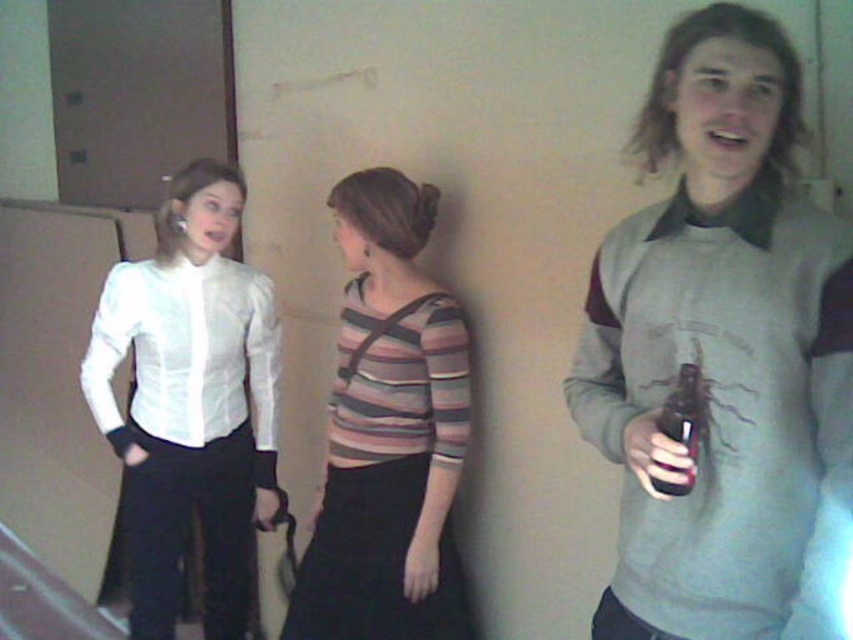
Question: Does gray sweater at center have a lesser width compared to translucent plastic bottle at right?

Choices:
 (A) yes
 (B) no

Answer: (B)

Question: Does gray sweater at center appear under translucent plastic bottle at right?

Choices:
 (A) no
 (B) yes

Answer: (A)

Question: Which point appears closest to the camera in this image?

Choices:
 (A) (700, 433)
 (B) (314, 544)

Answer: (A)

Question: Which object is positioned farthest from the translucent plastic bottle at right?

Choices:
 (A) striped fabric top at center
 (B) gray sweater at center
 (C) white satin blouse at left

Answer: (C)

Question: Which point is closer to the camera?

Choices:
 (A) gray sweater at center
 (B) translucent plastic bottle at right

Answer: (A)

Question: In this image, where is striped fabric top at center located relative to translucent plastic bottle at right?

Choices:
 (A) below
 (B) above

Answer: (A)